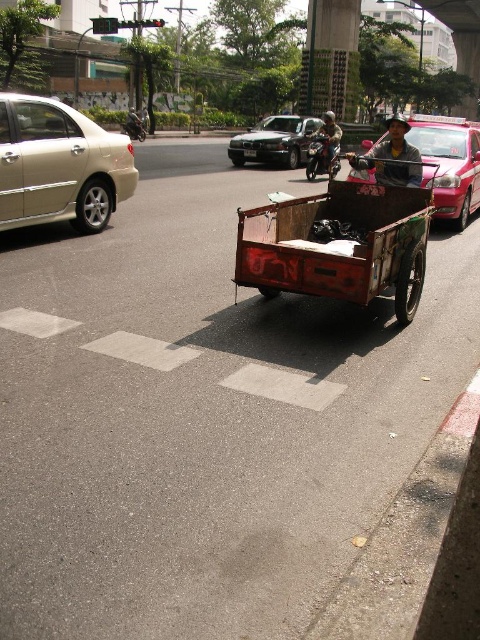
Does gold metallic sedan at left have a lesser width compared to shiny black motorcycle at center?

Yes.

Where is `gold metallic sedan at left`? This screenshot has width=480, height=640. gold metallic sedan at left is located at coordinates (59, 164).

Looking at this image, which is more to the right, shiny black motorcycle at center or metallic helmet at upper center?

shiny black motorcycle at center is more to the right.

Does shiny black motorcycle at center come in front of metallic helmet at upper center?

No.

Does point (132, 134) come closer to viewer compared to point (136, 131)?

No, it is not.

Where is `shiny black motorcycle at center`? The width and height of the screenshot is (480, 640). shiny black motorcycle at center is located at coordinates pyautogui.click(x=133, y=128).

Does rusty wooden cart at center appear over metallic helmet at upper center?

No, rusty wooden cart at center is not above metallic helmet at upper center.

Does point (300, 260) come in front of point (133, 125)?

Yes, point (300, 260) is in front of point (133, 125).

The image size is (480, 640). What do you see at coordinates (337, 244) in the screenshot?
I see `rusty wooden cart at center` at bounding box center [337, 244].

Locate an element on the screen. The width and height of the screenshot is (480, 640). rusty wooden cart at center is located at coordinates pos(337,244).